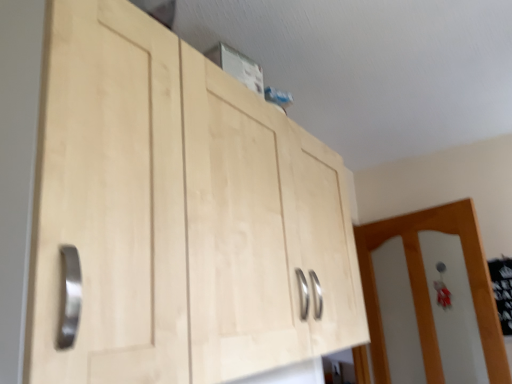
Question: Is white glossy door at right taller than natural wood cabinet at upper center?

Choices:
 (A) no
 (B) yes

Answer: (B)

Question: Is white glossy door at right wider than natural wood cabinet at upper center?

Choices:
 (A) no
 (B) yes

Answer: (A)

Question: From the image's perspective, would you say white glossy door at right is positioned over natural wood cabinet at upper center?

Choices:
 (A) no
 (B) yes

Answer: (A)

Question: Are white glossy door at right and natural wood cabinet at upper center far apart?

Choices:
 (A) yes
 (B) no

Answer: (A)

Question: From a real-world perspective, is white glossy door at right beneath natural wood cabinet at upper center?

Choices:
 (A) yes
 (B) no

Answer: (A)

Question: Considering the relative sizes of white glossy door at right and natural wood cabinet at upper center in the image provided, is white glossy door at right thinner than natural wood cabinet at upper center?

Choices:
 (A) no
 (B) yes

Answer: (B)

Question: Is natural wood cabinet at upper center oriented towards white glossy door at right?

Choices:
 (A) no
 (B) yes

Answer: (A)

Question: Are natural wood cabinet at upper center and white glossy door at right beside each other?

Choices:
 (A) yes
 (B) no

Answer: (B)

Question: Would you consider natural wood cabinet at upper center to be distant from white glossy door at right?

Choices:
 (A) yes
 (B) no

Answer: (A)

Question: Is natural wood cabinet at upper center wider than white glossy door at right?

Choices:
 (A) yes
 (B) no

Answer: (A)

Question: Can you confirm if natural wood cabinet at upper center is positioned to the left of white glossy door at right?

Choices:
 (A) no
 (B) yes

Answer: (B)

Question: From a real-world perspective, is natural wood cabinet at upper center physically above white glossy door at right?

Choices:
 (A) yes
 (B) no

Answer: (A)

Question: Is point (126, 259) positioned closer to the camera than point (373, 304)?

Choices:
 (A) farther
 (B) closer

Answer: (B)